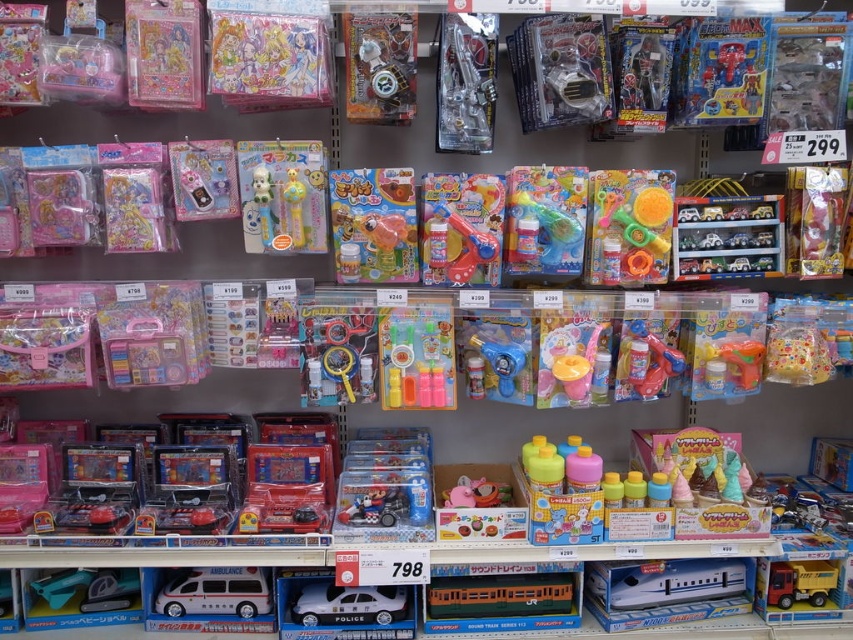
Question: Based on their relative distances, which object is farther from the white plastic police car at lower center?

Choices:
 (A) yellow rubber toy at center
 (B) metallic orange train at center

Answer: (A)

Question: Does white plastic airplane at lower center have a greater width compared to white plastic ambulance at lower center?

Choices:
 (A) yes
 (B) no

Answer: (A)

Question: Which point is farther from the camera taking this photo?

Choices:
 (A) (491, 496)
 (B) (144, 321)
 (C) (550, 371)

Answer: (A)

Question: Is white plastic airplane at lower center above white plastic ambulance at lower center?

Choices:
 (A) no
 (B) yes

Answer: (B)

Question: Is white plastic airplane at lower center wider than yellow matte truck at lower right?

Choices:
 (A) no
 (B) yes

Answer: (B)

Question: Among these objects, which one is farthest from the camera?

Choices:
 (A) white plastic ambulance at lower center
 (B) metallic orange train at center

Answer: (A)